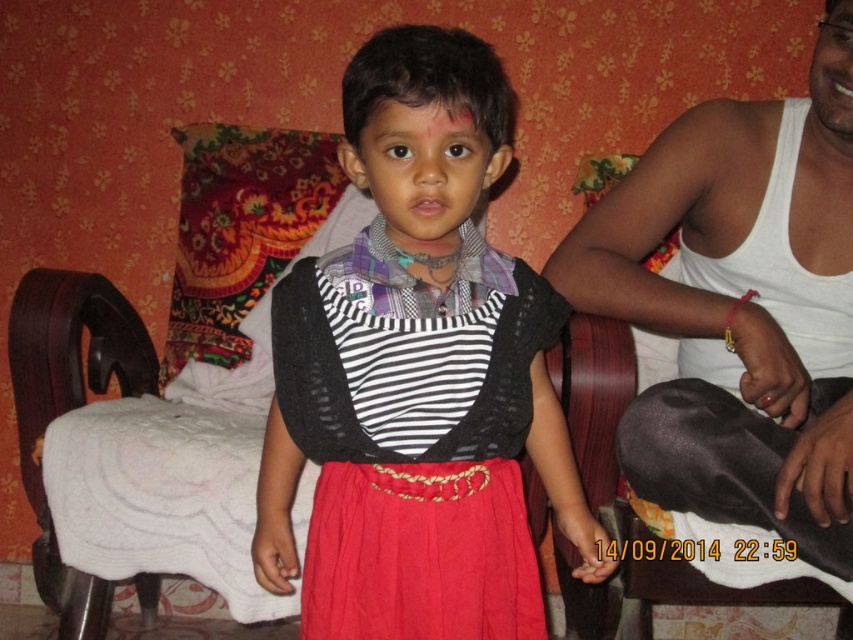
You are a photographer setting up for a family photo. You need to ensure the matte black sweater at center is visible without being blocked by the white fabric armchair at left. Based on the scene description, is the current arrangement suitable?

The matte black sweater at center is in front of the white fabric armchair at left, so the sweater is not blocked and the current arrangement is suitable for the photo.

You are a photographer setting up for a family portrait. You need to position the matte black sweater at center and the white fabric armchair at left in a way that aligns with their current spatial arrangement. Which object should be placed to the right of the other?

The matte black sweater at center is positioned on the right side of the white fabric armchair at left, so the sweater should be placed to the right of the armchair.

You are a photographer setting up a photo shoot in this room. You need to decide where to place a 1.2 meter tall backdrop stand. The stand requires at least 1.5 meters of clearance in height. Looking at the white tank top at right and the white fabric armchair at left, which object would you avoid placing the stand near to ensure enough space?

You should avoid placing the backdrop stand near the white fabric armchair at left because the white tank top at right has a lesser height, meaning the armchair is taller and might obstruct the required 1.5 meters of vertical clearance.